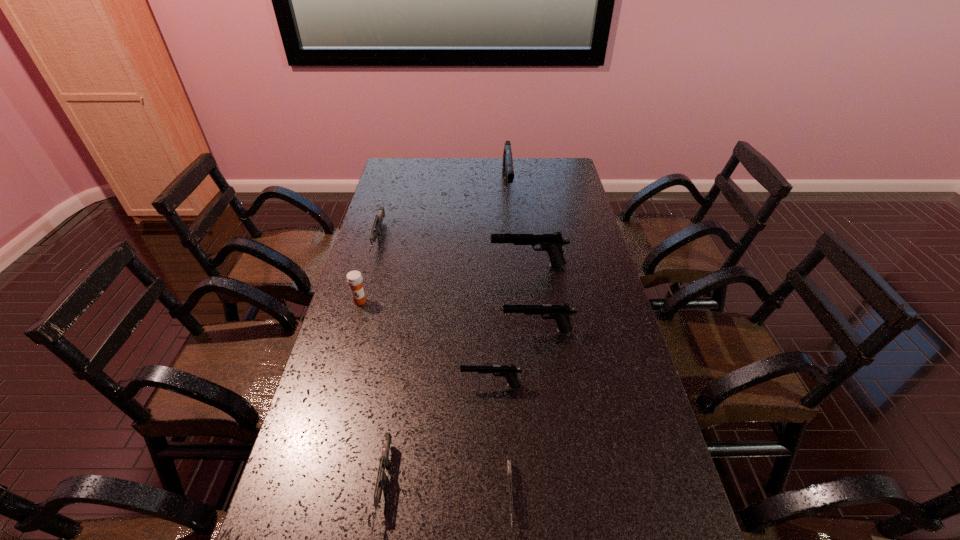
Find the location of a particular element. The width and height of the screenshot is (960, 540). vacant area at the right edge is located at coordinates (576, 205).

Identify the location of vacant space that is in between the third smallest black gun and the third tallest gun. (533, 298).

Where is `free space between the medicine and the smallest black gun`? The height and width of the screenshot is (540, 960). free space between the medicine and the smallest black gun is located at coordinates (425, 343).

You are a GUI agent. You are given a task and a screenshot of the screen. Output one action in this format:
    pyautogui.click(x=<x>, y=<y>)
    Task: Click on the free space that is in between the smallest black gun and the second tallest gun
    
    Given the screenshot: What is the action you would take?
    pyautogui.click(x=510, y=325)

Locate an element on the screen. This screenshot has width=960, height=540. empty location between the second biggest black gun and the biggest grey gun is located at coordinates (453, 252).

In order to click on vacant space that's between the tallest gun and the medicine in this screenshot , I will do `click(434, 245)`.

You are a GUI agent. You are given a task and a screenshot of the screen. Output one action in this format:
    pyautogui.click(x=<x>, y=<y>)
    Task: Click on the free space between the third nearest gun and the rightmost grey gun
    The image size is (960, 540).
    Given the screenshot: What is the action you would take?
    [x=500, y=441]

Locate an element on the screen. The width and height of the screenshot is (960, 540). empty space between the shortest object and the smallest black gun is located at coordinates (500, 441).

You are a GUI agent. You are given a task and a screenshot of the screen. Output one action in this format:
    pyautogui.click(x=<x>, y=<y>)
    Task: Click on the vacant space in between the shortest gun and the leftmost gun
    The height and width of the screenshot is (540, 960).
    Given the screenshot: What is the action you would take?
    pyautogui.click(x=444, y=368)

Select which object is the second closest to the fifth farthest object. Please provide its 2D coordinates. Your answer should be formatted as a tuple, i.e. [(x, y)], where the tuple contains the x and y coordinates of a point satisfying the conditions above.

[(551, 242)]